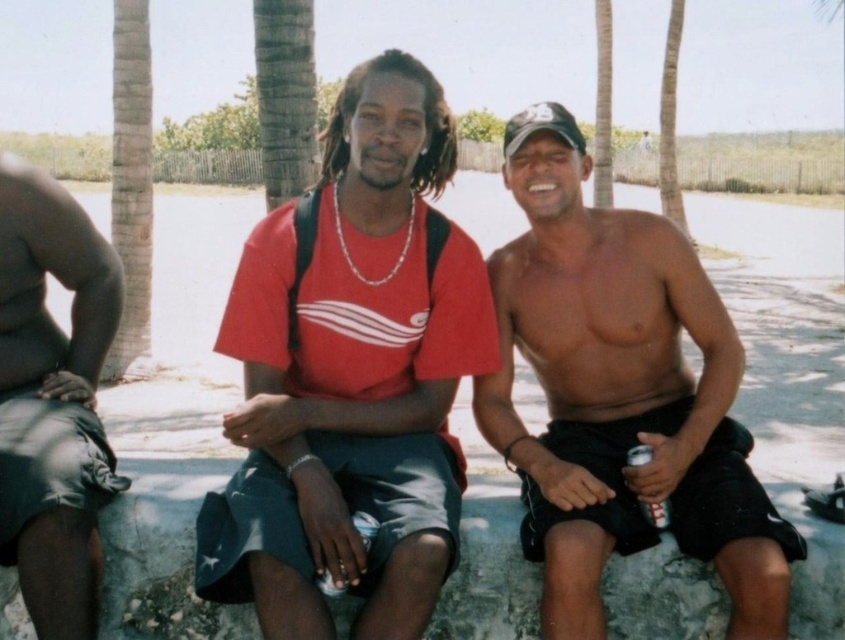
Which of these two, red matte shirt at center or shiny black shorts at center, stands taller?

red matte shirt at center is taller.

Does red matte shirt at center come behind shiny black shorts at center?

No, red matte shirt at center is in front of shiny black shorts at center.

Describe the element at coordinates (352, 378) in the screenshot. This screenshot has width=845, height=640. I see `red matte shirt at center` at that location.

Identify the location of red matte shirt at center. (352, 378).

Can you confirm if red matte shirt at center is bigger than dark gray shorts at left?

Indeed, red matte shirt at center has a larger size compared to dark gray shorts at left.

Is the position of red matte shirt at center less distant than that of dark gray shorts at left?

Yes.

Is point (249, 566) positioned in front of point (52, 236)?

Yes, point (249, 566) is closer to viewer.

Find the location of a particular element. The height and width of the screenshot is (640, 845). red matte shirt at center is located at coordinates (352, 378).

Is shiny black shorts at center taller than dark gray shorts at left?

Indeed, shiny black shorts at center has a greater height compared to dark gray shorts at left.

Which is below, shiny black shorts at center or dark gray shorts at left?

dark gray shorts at left is below.

This screenshot has width=845, height=640. Describe the element at coordinates (620, 396) in the screenshot. I see `shiny black shorts at center` at that location.

Locate an element on the screen. shiny black shorts at center is located at coordinates (620, 396).